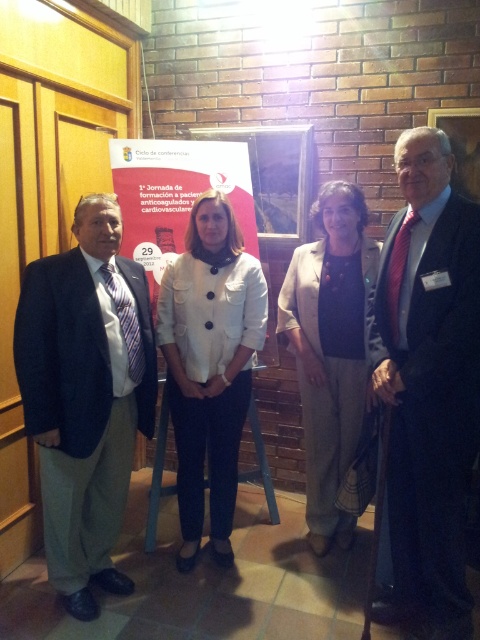
You are a GUI agent. You are given a task and a screenshot of the screen. Output one action in this format:
    pyautogui.click(x=<x>, y=<y>)
    Task: Click on the white fabric coat at center
    Image resolution: width=480 pixels, height=640 pixels.
    Given the screenshot: What is the action you would take?
    pyautogui.click(x=210, y=365)

Is point (208, 221) closer to camera compared to point (275, 497)?

Yes, it is in front of point (275, 497).

Where is `white fabric coat at center`? This screenshot has height=640, width=480. white fabric coat at center is located at coordinates (210, 365).

Does point (474, 381) come in front of point (120, 285)?

Yes, it is in front of point (120, 285).

Identify the location of dark blue suit at center. The height and width of the screenshot is (640, 480). (429, 385).

Does white fabric coat at center have a smaller size compared to beige woolen jacket at center?

Correct, white fabric coat at center occupies less space than beige woolen jacket at center.

Is white fabric coat at center to the right of beige woolen jacket at center from the viewer's perspective?

In fact, white fabric coat at center is to the left of beige woolen jacket at center.

The image size is (480, 640). What do you see at coordinates (210, 365) in the screenshot?
I see `white fabric coat at center` at bounding box center [210, 365].

The height and width of the screenshot is (640, 480). Find the location of `white fabric coat at center`. white fabric coat at center is located at coordinates (210, 365).